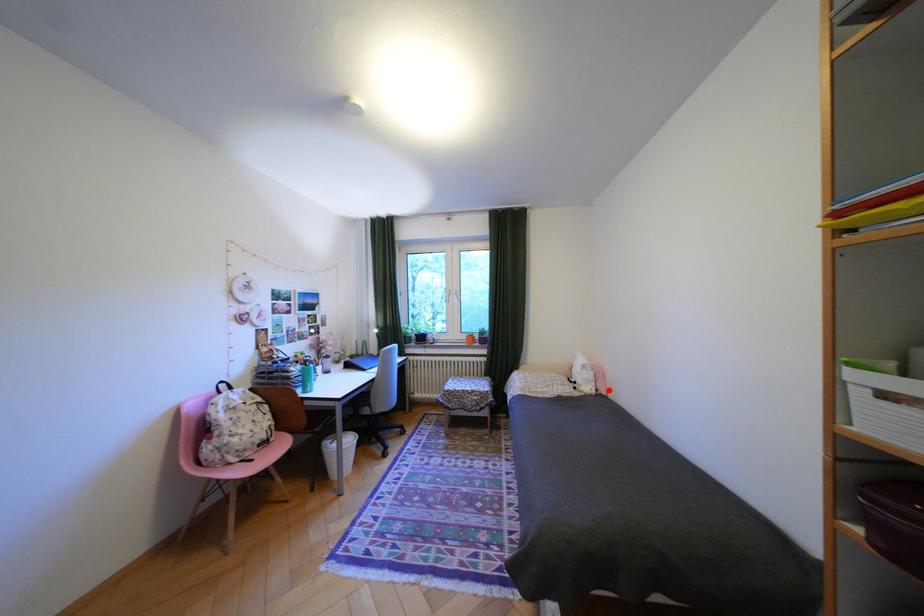
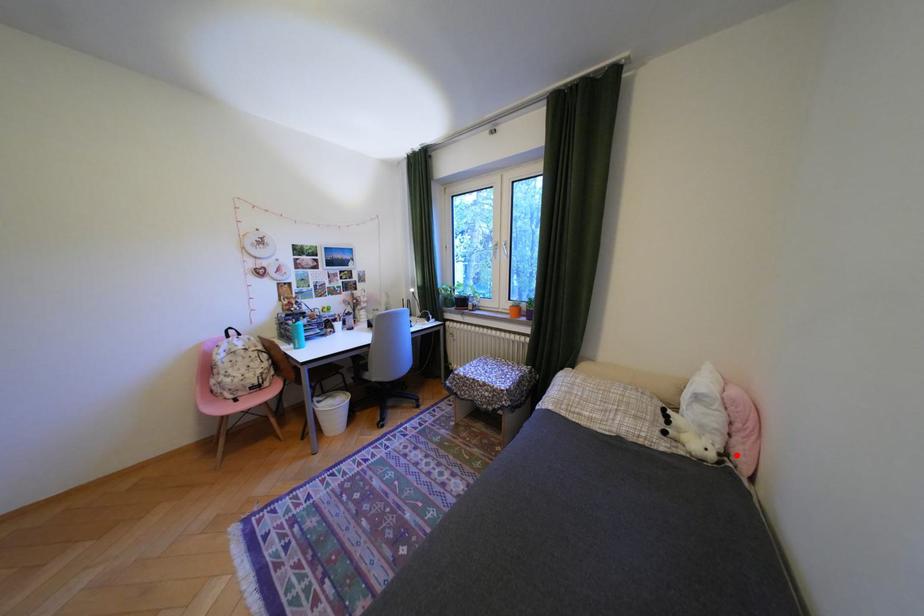
I am providing you with two images of the same scene from different viewpoints. A red point is marked on the first image and another point is marked on the second image. Do the highlighted points in image1 and image2 indicate the same real-world spot?

Yes